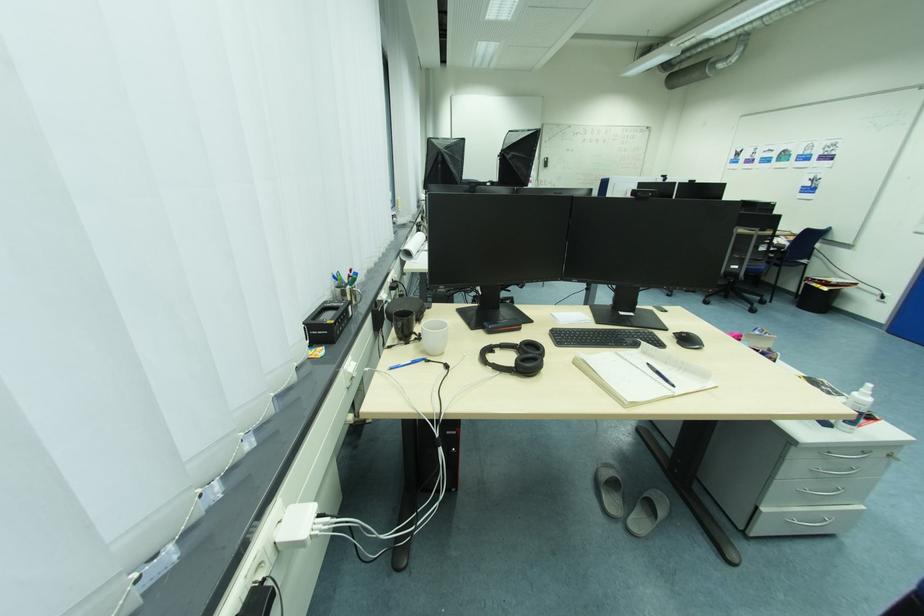
What do you see at coordinates (816, 297) in the screenshot? Image resolution: width=924 pixels, height=616 pixels. I see `the black trash bin` at bounding box center [816, 297].